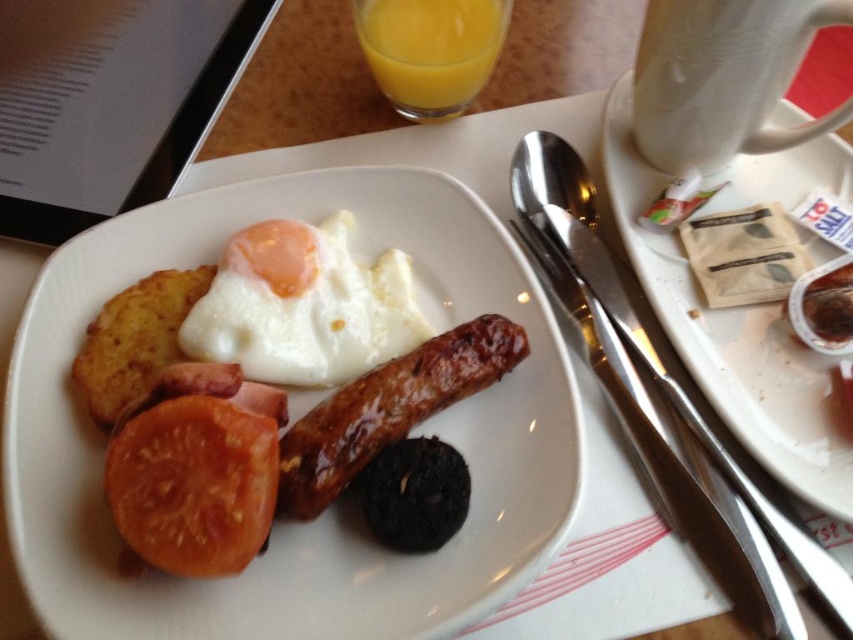
Is red matte tomato at lower left positioned in front of golden brown fried potato at upper left?

Yes.

Is red matte tomato at lower left smaller than golden brown fried potato at upper left?

Correct, red matte tomato at lower left occupies less space than golden brown fried potato at upper left.

This screenshot has height=640, width=853. I want to click on red matte tomato at lower left, so (193, 484).

Where is `red matte tomato at lower left`? This screenshot has height=640, width=853. red matte tomato at lower left is located at coordinates (193, 484).

Does red matte tomato at lower left have a smaller size compared to orange liquid at upper center?

Yes, red matte tomato at lower left is smaller than orange liquid at upper center.

Is point (216, 554) less distant than point (468, 28)?

That is True.

The height and width of the screenshot is (640, 853). Identify the location of red matte tomato at lower left. (193, 484).

Can you confirm if slightly browned ceramic plate at center is positioned to the right of orange liquid at upper center?

In fact, slightly browned ceramic plate at center is to the left of orange liquid at upper center.

Does point (366, 618) lie behind point (404, 29)?

That is False.

Find the location of a particular element. This screenshot has width=853, height=640. slightly browned ceramic plate at center is located at coordinates (329, 509).